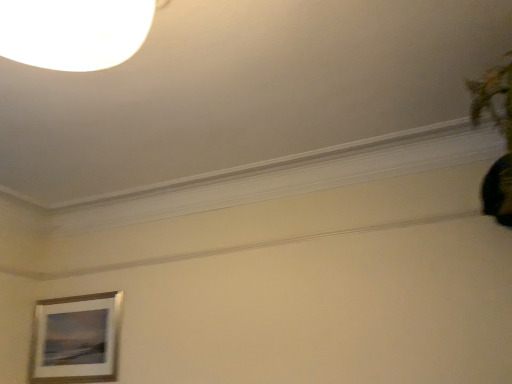
Question: Is wooden frame at lower left bigger or smaller than green leafy plant at upper right?

Choices:
 (A) small
 (B) big

Answer: (A)

Question: From their relative heights in the image, would you say wooden frame at lower left is taller or shorter than green leafy plant at upper right?

Choices:
 (A) short
 (B) tall

Answer: (B)

Question: In terms of width, does wooden frame at lower left look wider or thinner when compared to green leafy plant at upper right?

Choices:
 (A) thin
 (B) wide

Answer: (A)

Question: In terms of width, does green leafy plant at upper right look wider or thinner when compared to wooden frame at lower left?

Choices:
 (A) thin
 (B) wide

Answer: (B)

Question: From a real-world perspective, is green leafy plant at upper right physically located above or below wooden frame at lower left?

Choices:
 (A) below
 (B) above

Answer: (B)

Question: From their relative heights in the image, would you say green leafy plant at upper right is taller or shorter than wooden frame at lower left?

Choices:
 (A) short
 (B) tall

Answer: (A)

Question: In terms of size, does green leafy plant at upper right appear bigger or smaller than wooden frame at lower left?

Choices:
 (A) small
 (B) big

Answer: (B)